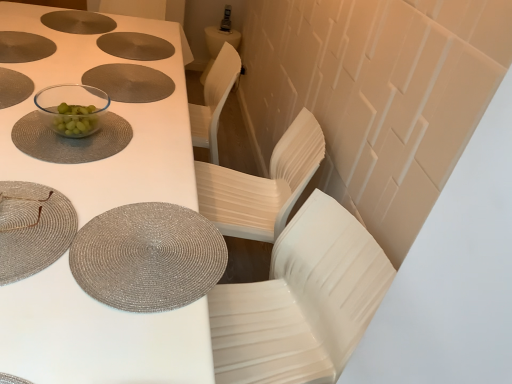
Locate an element on the screen. This screenshot has height=384, width=512. matte silver placemat at center is located at coordinates (130, 82).

Image resolution: width=512 pixels, height=384 pixels. What do you see at coordinates (148, 257) in the screenshot?
I see `silver textured placemat at lower left, the 2th tableware positioned from the front` at bounding box center [148, 257].

What do you see at coordinates (32, 228) in the screenshot? I see `silver woven placemat at lower left, acting as the fourth tableware starting from the top` at bounding box center [32, 228].

Identify the location of transparent glass bowl at center, positioned as the fourth tableware in front-to-back order. The width and height of the screenshot is (512, 384). (72, 108).

Identify the location of white glossy chair at center. (301, 301).

I want to click on transparent glass bowl at center, which appears as the 3th tableware when viewed from the front, so click(70, 140).

Locate an element on the screen. This screenshot has width=512, height=384. matte silver placemat at center is located at coordinates (130, 82).

Does matte silver placemat at upper center, the 1th tableware positioned from the back, have a greater height compared to silver woven placemat at lower left, positioned as the 5th tableware in back-to-front order?

Yes.

Which is behind, matte silver placemat at upper center, the 1th tableware positioned from the back, or silver woven placemat at lower left, positioned as the 5th tableware in back-to-front order?

matte silver placemat at upper center, the 1th tableware positioned from the back.

From a real-world perspective, is matte silver placemat at upper center, marked as the fifth tableware in a front-to-back arrangement, positioned over silver woven placemat at lower left, acting as the fourth tableware starting from the top, based on gravity?

No, from a real-world perspective, matte silver placemat at upper center, marked as the fifth tableware in a front-to-back arrangement, is not over silver woven placemat at lower left, acting as the fourth tableware starting from the top

Is matte silver placemat at upper center, the fifth tableware when ordered from bottom to top, inside or outside of transparent glass bowl at center, placed as the fourth tableware when sorted from bottom to top?

matte silver placemat at upper center, the fifth tableware when ordered from bottom to top, is spatially situated outside transparent glass bowl at center, placed as the fourth tableware when sorted from bottom to top.

Can you tell me how much matte silver placemat at upper center, the fifth tableware when ordered from bottom to top, and transparent glass bowl at center, which appears as the 2th tableware when viewed from the back, differ in facing direction?

The facing directions of matte silver placemat at upper center, the fifth tableware when ordered from bottom to top, and transparent glass bowl at center, which appears as the 2th tableware when viewed from the back, are 173 degrees apart.

Between matte silver placemat at upper center, the 1th tableware positioned from the back, and transparent glass bowl at center, placed as the fourth tableware when sorted from bottom to top, which one appears on the right side from the viewer's perspective?

From the viewer's perspective, transparent glass bowl at center, placed as the fourth tableware when sorted from bottom to top, appears more on the right side.

Considering the sizes of objects matte silver placemat at upper center, marked as the fifth tableware in a front-to-back arrangement, and transparent glass bowl at center, which appears as the 2th tableware when viewed from the back, in the image provided, who is wider, matte silver placemat at upper center, marked as the fifth tableware in a front-to-back arrangement, or transparent glass bowl at center, which appears as the 2th tableware when viewed from the back,?

Wider between the two is matte silver placemat at upper center, marked as the fifth tableware in a front-to-back arrangement.

Considering the relative sizes of white textured table at center and matte silver placemat at upper center, which ranks as the 1th tableware in top-to-bottom order, in the image provided, is white textured table at center smaller than matte silver placemat at upper center, which ranks as the 1th tableware in top-to-bottom order,?

No.

Is white textured table at center located outside matte silver placemat at upper center, marked as the fifth tableware in a front-to-back arrangement?

Yes, white textured table at center is outside of matte silver placemat at upper center, marked as the fifth tableware in a front-to-back arrangement.

From the picture: Considering the positions of objects white textured table at center and matte silver placemat at upper center, the 1th tableware positioned from the back, in the image provided, who is more to the right, white textured table at center or matte silver placemat at upper center, the 1th tableware positioned from the back,?

Positioned to the right is matte silver placemat at upper center, the 1th tableware positioned from the back.

From the image's perspective, between white textured table at center and matte silver placemat at upper center, marked as the fifth tableware in a front-to-back arrangement, who is located below?

white textured table at center.

Based on the photo, considering the relative sizes of silver woven placemat at lower left, arranged as the 2th tableware when ordered from the bottom, and transparent glass bowl at center, positioned as the fourth tableware in front-to-back order, in the image provided, is silver woven placemat at lower left, arranged as the 2th tableware when ordered from the bottom, taller than transparent glass bowl at center, positioned as the fourth tableware in front-to-back order,?

No, silver woven placemat at lower left, arranged as the 2th tableware when ordered from the bottom, is not taller than transparent glass bowl at center, positioned as the fourth tableware in front-to-back order.

The height and width of the screenshot is (384, 512). What are the coordinates of `the 3rd tableware in front of the transparent glass bowl at center, positioned as the fourth tableware in front-to-back order` in the screenshot? It's located at (32, 228).

From a real-world perspective, is silver woven placemat at lower left, acting as the fourth tableware starting from the top, positioned above or below transparent glass bowl at center, placed as the fourth tableware when sorted from bottom to top?

In terms of real-world spatial position, silver woven placemat at lower left, acting as the fourth tableware starting from the top, is below transparent glass bowl at center, placed as the fourth tableware when sorted from bottom to top.

Is silver woven placemat at lower left, arranged as the 2th tableware when ordered from the bottom, bigger than white textured table at center?

Incorrect, silver woven placemat at lower left, arranged as the 2th tableware when ordered from the bottom, is not larger than white textured table at center.

From the picture: Is silver woven placemat at lower left, which is the first tableware in front-to-back order, facing towards white textured table at center?

Yes, silver woven placemat at lower left, which is the first tableware in front-to-back order, is oriented towards white textured table at center.

From a real-world perspective, which object rests below the other?

white textured table at center, from a real-world perspective.

From the image's perspective, is silver woven placemat at lower left, positioned as the 5th tableware in back-to-front order, on top of white textured table at center?

No.

Is point (153, 86) closer or farther from the camera than point (89, 251)?

Point (153, 86) is farther from the camera than point (89, 251).

Considering the sizes of objects matte silver placemat at center and silver textured placemat at lower left, which ranks as the 1th tableware in bottom-to-top order, in the image provided, who is shorter, matte silver placemat at center or silver textured placemat at lower left, which ranks as the 1th tableware in bottom-to-top order,?

With less height is silver textured placemat at lower left, which ranks as the 1th tableware in bottom-to-top order.

Between matte silver placemat at center and silver textured placemat at lower left, the fourth tableware positioned from the back, which one has larger width?

silver textured placemat at lower left, the fourth tableware positioned from the back.

Looking at this image, considering the relative positions of silver textured placemat at lower left, the fourth tableware positioned from the back, and white glossy chair at center in the image provided, is silver textured placemat at lower left, the fourth tableware positioned from the back, to the left or to the right of white glossy chair at center?

Clearly, silver textured placemat at lower left, the fourth tableware positioned from the back, is on the left of white glossy chair at center in the image.

From a real-world perspective, is silver textured placemat at lower left, the fourth tableware positioned from the back, physically above white glossy chair at center?

Yes, from a real-world perspective, silver textured placemat at lower left, the fourth tableware positioned from the back, is above white glossy chair at center.

Is silver textured placemat at lower left, the 2th tableware positioned from the front, facing away from white glossy chair at center?

silver textured placemat at lower left, the 2th tableware positioned from the front, does not have its back to white glossy chair at center.

In the image, is silver textured placemat at lower left, which ranks as the 1th tableware in bottom-to-top order, positioned in front of or behind white glossy chair at center?

silver textured placemat at lower left, which ranks as the 1th tableware in bottom-to-top order, is positioned farther from the viewer than white glossy chair at center.

Find the location of `the 3rd tableware above the silver woven placemat at lower left, positioned as the 5th tableware in back-to-front order (from the image's perspective)`. the 3rd tableware above the silver woven placemat at lower left, positioned as the 5th tableware in back-to-front order (from the image's perspective) is located at coordinates (135, 46).

Which tableware is the 2nd one when counting from the right side of the matte silver placemat at upper center, marked as the fifth tableware in a front-to-back arrangement? Please provide its 2D coordinates.

[(72, 108)]

Considering their positions, is silver woven placemat at lower left, acting as the fourth tableware starting from the top, positioned further to silver textured placemat at lower left, arranged as the fifth tableware when viewed from the top, than transparent glass bowl at center, the third tableware when ordered from top to bottom?

transparent glass bowl at center, the third tableware when ordered from top to bottom, lies further to silver textured placemat at lower left, arranged as the fifth tableware when viewed from the top, than the other object.

Considering their positions, is matte silver placemat at upper center, marked as the fifth tableware in a front-to-back arrangement, positioned further to transparent glass bowl at center, which appears as the 3th tableware when viewed from the front, than white textured table at center?

The object further to transparent glass bowl at center, which appears as the 3th tableware when viewed from the front, is matte silver placemat at upper center, marked as the fifth tableware in a front-to-back arrangement.

Considering their positions, is matte silver placemat at upper center, the 1th tableware positioned from the back, positioned further to white textured table at center than silver textured placemat at lower left, arranged as the fifth tableware when viewed from the top?

matte silver placemat at upper center, the 1th tableware positioned from the back, lies further to white textured table at center than the other object.

Considering their positions, is matte silver placemat at center positioned closer to transparent glass bowl at center, the third tableware when ordered from top to bottom, than matte silver placemat at upper center, the 1th tableware positioned from the back?

matte silver placemat at center is closer to transparent glass bowl at center, the third tableware when ordered from top to bottom.

Looking at the image, which one is located closer to matte silver placemat at upper center, the fifth tableware when ordered from bottom to top, transparent glass bowl at center, placed as the fourth tableware when sorted from bottom to top, or white glossy chair at center?

The object closer to matte silver placemat at upper center, the fifth tableware when ordered from bottom to top, is transparent glass bowl at center, placed as the fourth tableware when sorted from bottom to top.

Looking at the image, which one is located closer to silver textured placemat at lower left, the fourth tableware positioned from the back, white textured table at center or matte silver placemat at center?

white textured table at center is positioned closer to the anchor silver textured placemat at lower left, the fourth tableware positioned from the back.

Estimate the real-world distances between objects in this image. Which object is closer to silver woven placemat at lower left, acting as the fourth tableware starting from the top, white textured table at center or transparent glass bowl at center, placed as the third tableware when sorted from back to front?

transparent glass bowl at center, placed as the third tableware when sorted from back to front.

Looking at the image, which one is located closer to white textured table at center, white glossy chair at center or transparent glass bowl at center, the 2th tableware viewed from the top?

transparent glass bowl at center, the 2th tableware viewed from the top, is closer to white textured table at center.

This screenshot has height=384, width=512. I want to click on plate between silver woven placemat at lower left, which is the first tableware in front-to-back order, and matte silver placemat at upper center, which ranks as the 1th tableware in top-to-bottom order, in the front-back direction, so click(130, 82).

At what (x,y) coordinates should I click in order to perform the action: click on chair located between white textured table at center and matte silver placemat at center in the depth direction. Please return your answer as a coordinate pair (x, y). This screenshot has height=384, width=512. Looking at the image, I should click on (301, 301).

Find the location of a particular element. The height and width of the screenshot is (384, 512). tableware between silver woven placemat at lower left, which is the first tableware in front-to-back order, and transparent glass bowl at center, which ranks as the 3th tableware in bottom-to-top order, along the z-axis is located at coordinates (148, 257).

At what (x,y) coordinates should I click in order to perform the action: click on plate between transparent glass bowl at center, positioned as the fourth tableware in front-to-back order, and matte silver placemat at upper center, which ranks as the 1th tableware in top-to-bottom order, from front to back. Please return your answer as a coordinate pair (x, y). Image resolution: width=512 pixels, height=384 pixels. Looking at the image, I should click on (130, 82).